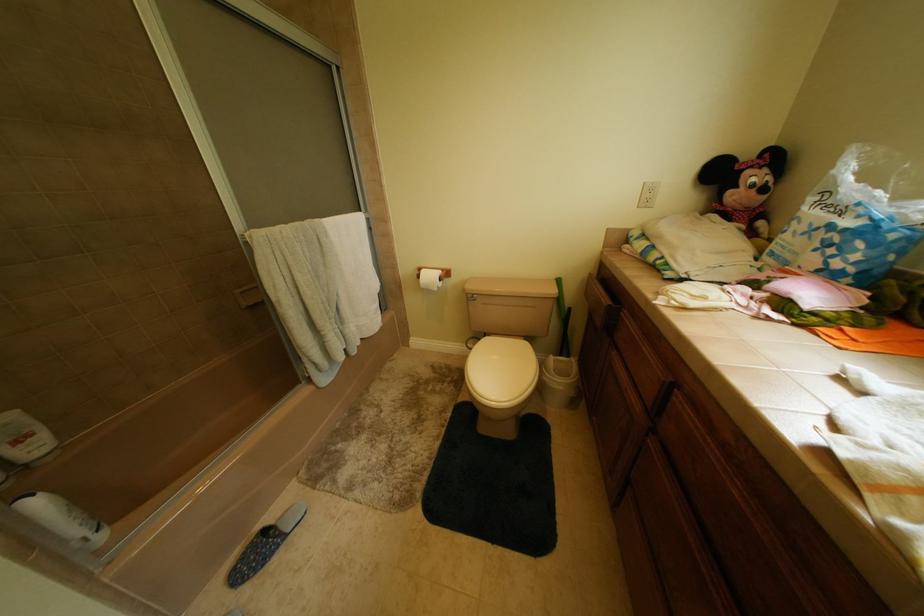
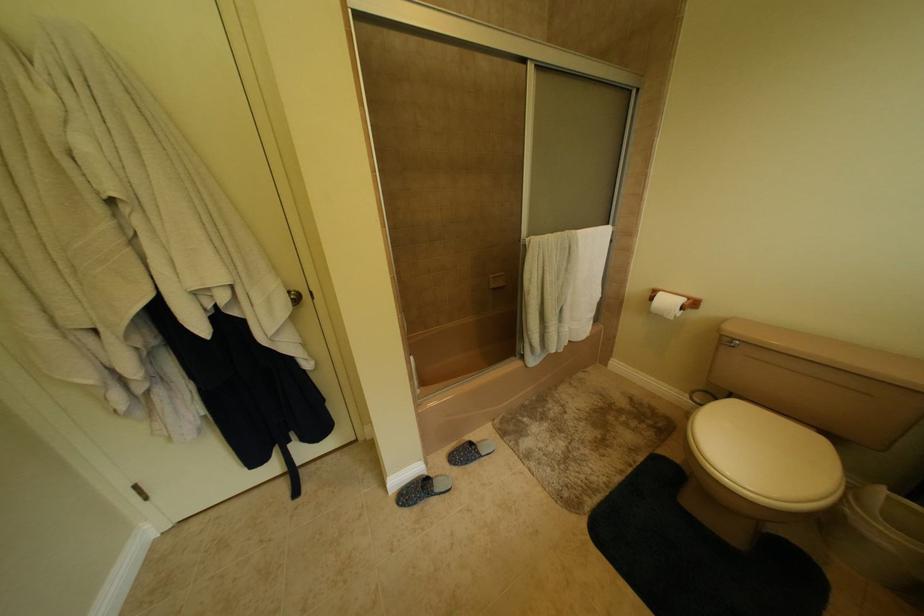
Question: The first image is from the beginning of the video and the second image is from the end. How did the camera likely rotate when shooting the video?

Choices:
 (A) Left
 (B) Right
 (C) Up
 (D) Down

Answer: (A)